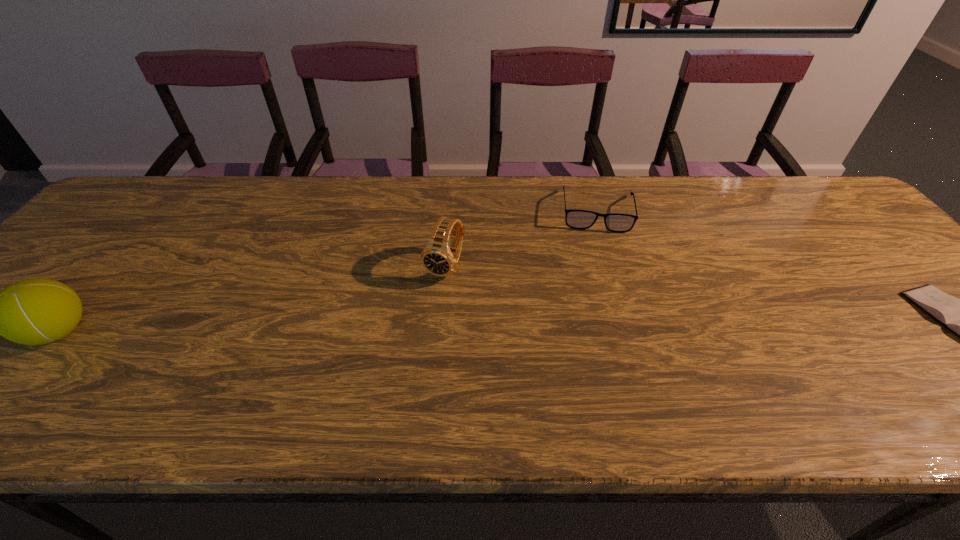
The height and width of the screenshot is (540, 960). I want to click on vacant area that lies between the second object from left to right and the leftmost object, so click(252, 300).

I want to click on vacant region between the second object from left to right and the third object from left to right, so (521, 239).

You are a GUI agent. You are given a task and a screenshot of the screen. Output one action in this format:
    pyautogui.click(x=<x>, y=<y>)
    Task: Click on the free space between the tennis ball and the third object from right to left
    
    Given the screenshot: What is the action you would take?
    pyautogui.click(x=252, y=300)

The width and height of the screenshot is (960, 540). I want to click on vacant region between the leftmost object and the third object from right to left, so point(252,300).

The height and width of the screenshot is (540, 960). I want to click on the closest object to the farthest object, so click(439, 258).

Where is `the third closest object to the tennis ball`? This screenshot has height=540, width=960. the third closest object to the tennis ball is located at coordinates (958, 315).

The height and width of the screenshot is (540, 960). Find the location of `free space in the image that satisfies the following two spatial constraints: 1. on the back side of the watch; 2. on the left side of the tennis ball`. free space in the image that satisfies the following two spatial constraints: 1. on the back side of the watch; 2. on the left side of the tennis ball is located at coordinates (114, 267).

Identify the location of vacant space that satisfies the following two spatial constraints: 1. on the back side of the third object from right to left; 2. on the right side of the spectacles. The height and width of the screenshot is (540, 960). (449, 211).